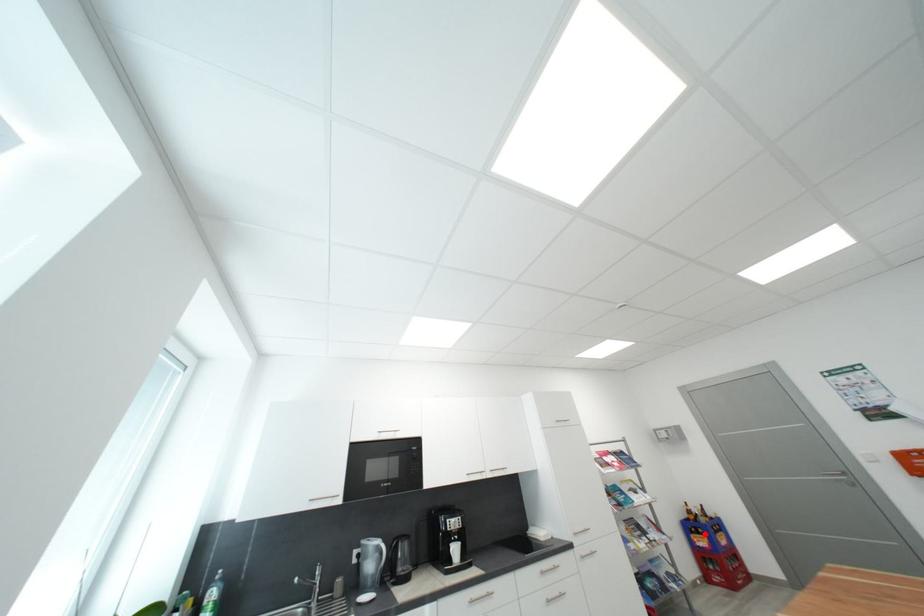
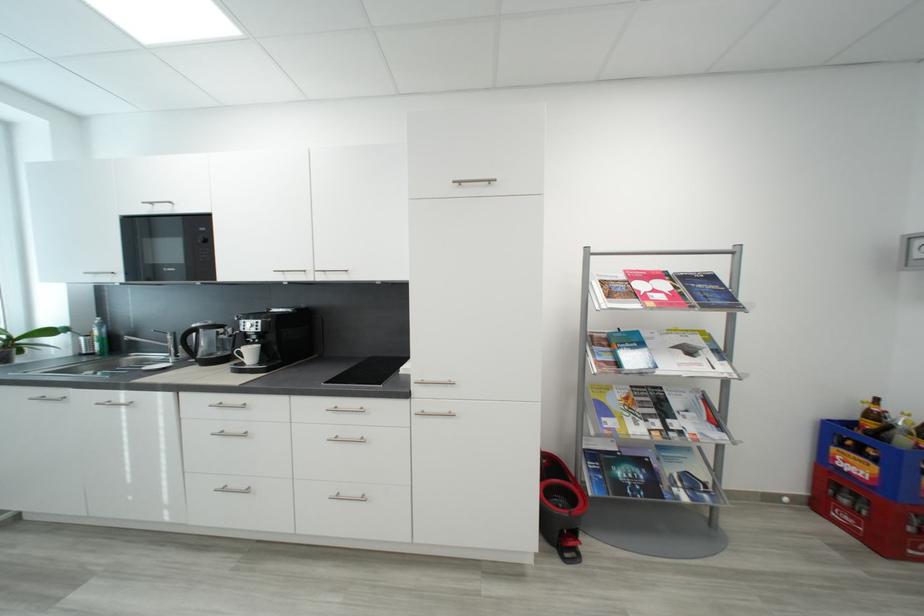
Find the pixel in the second image that matches the highlighted location in the first image.

(867, 454)